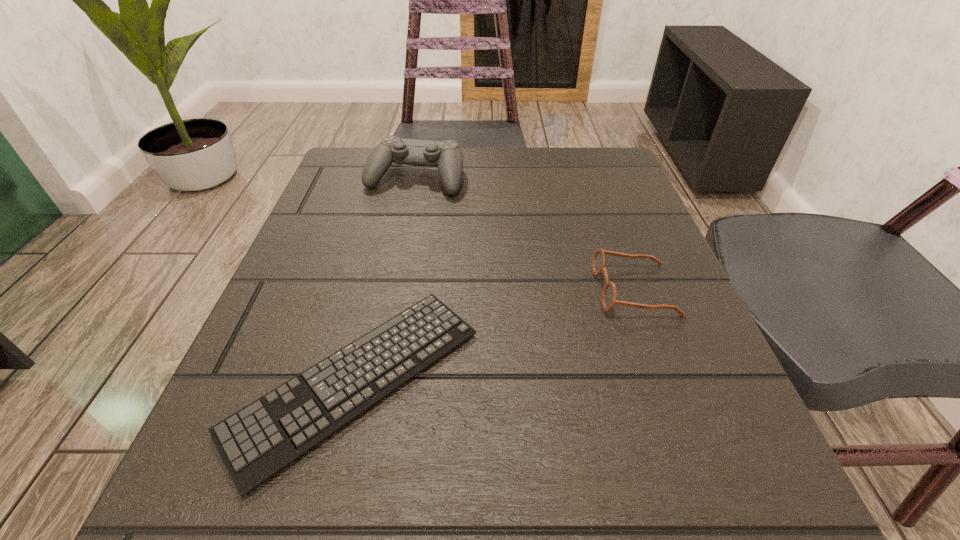
Find the location of a particular element. vacant point at the right edge is located at coordinates (649, 248).

The image size is (960, 540). What are the coordinates of `vacant space at the far left corner of the desktop` in the screenshot? It's located at (376, 186).

Locate an element on the screen. Image resolution: width=960 pixels, height=540 pixels. vacant space at the near right corner of the desktop is located at coordinates (767, 522).

Find the location of `empty space between the spectacles and the control`. empty space between the spectacles and the control is located at coordinates (525, 234).

The height and width of the screenshot is (540, 960). What are the coordinates of `free space between the computer keyboard and the farthest object` in the screenshot? It's located at (386, 279).

Find the location of a particular element. This screenshot has height=540, width=960. free space between the spectacles and the shortest object is located at coordinates (495, 335).

Identify the location of vacant space in between the rightmost object and the farthest object. (525, 234).

Where is `empty space that is in between the rightmost object and the farthest object`? The image size is (960, 540). empty space that is in between the rightmost object and the farthest object is located at coordinates (525, 234).

The height and width of the screenshot is (540, 960). Identify the location of vacant area between the control and the spectacles. (525, 234).

Where is `free space between the spectacles and the shortest object`? This screenshot has width=960, height=540. free space between the spectacles and the shortest object is located at coordinates (495, 335).